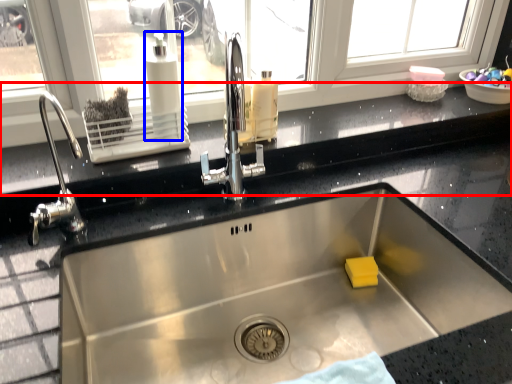
Question: Which point is further to the camera, window sill (highlighted by a red box) or soap dispenser (highlighted by a blue box)?

Choices:
 (A) window sill
 (B) soap dispenser

Answer: (B)